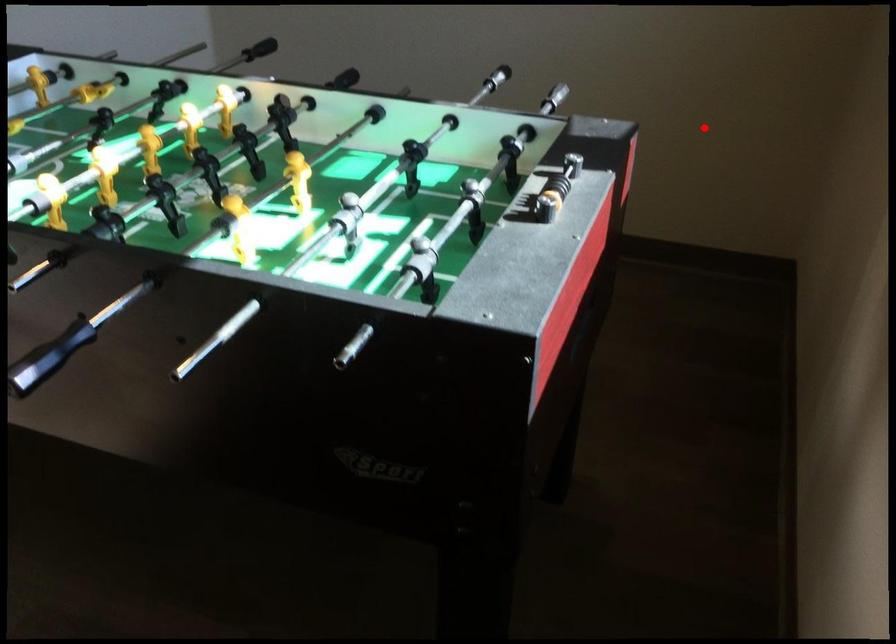
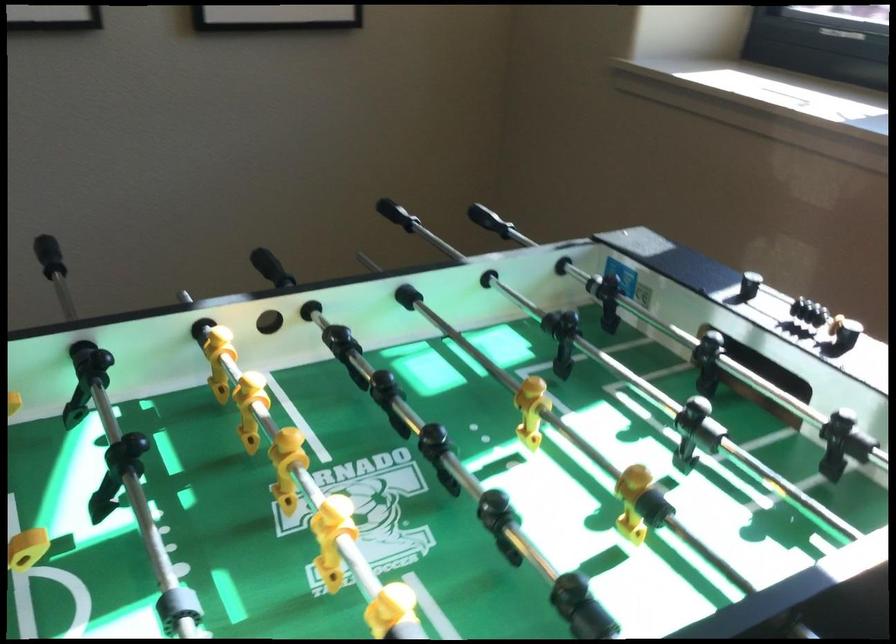
Where in the second image is the point corresponding to the highlighted location from the first image?

(397, 214)